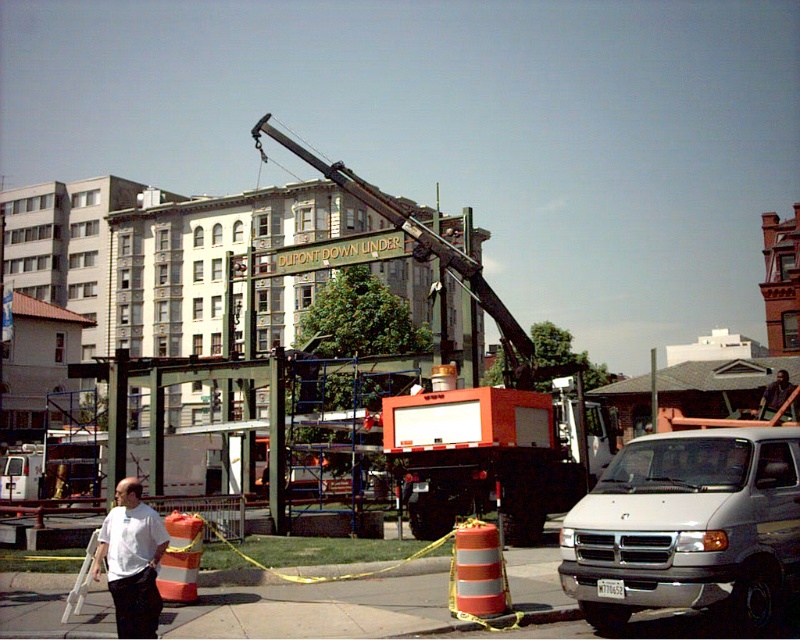
You are a delivery driver who needs to park your truck, which is 10 feet wide, in this area. Given the white matte van at center and the white shirt at center, can you safely park your truck without blocking the restricted area marked by the cones and tape?

The white matte van at center is larger than the white shirt at center. However, the size comparison between the van and the truck isn not provided. The restricted area is marked by cones and tape to the left of the van. To park safely without blocking it, position the truck behind the van or on the opposite side of the restricted area.